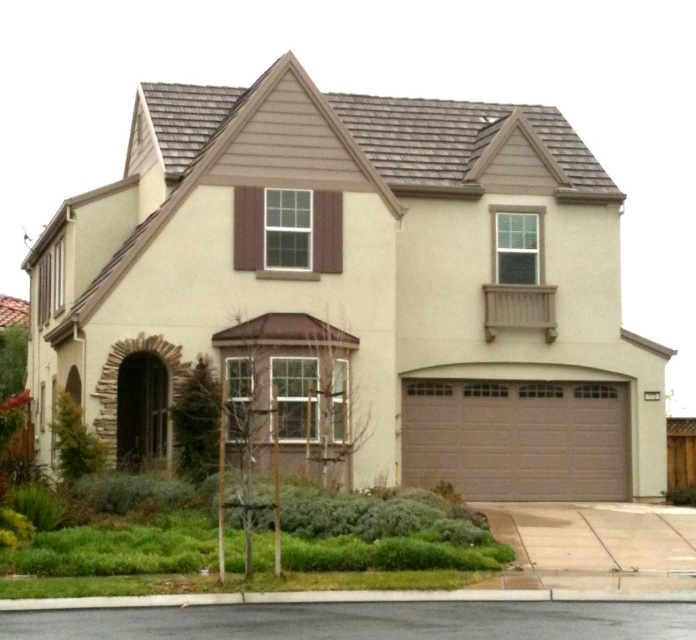
Question: Among these objects, which one is nearest to the camera?

Choices:
 (A) brown textured garage door at center
 (B) matte brown garage door at center

Answer: (B)

Question: Can you confirm if matte brown garage door at center is positioned above brown textured garage door at center?

Choices:
 (A) yes
 (B) no

Answer: (A)

Question: Can you confirm if matte brown garage door at center is positioned to the right of brown textured garage door at center?

Choices:
 (A) no
 (B) yes

Answer: (A)

Question: Which object is closer to the camera taking this photo?

Choices:
 (A) matte brown garage door at center
 (B) brown textured garage door at center

Answer: (A)

Question: Where is matte brown garage door at center located in relation to brown textured garage door at center in the image?

Choices:
 (A) above
 (B) below

Answer: (A)